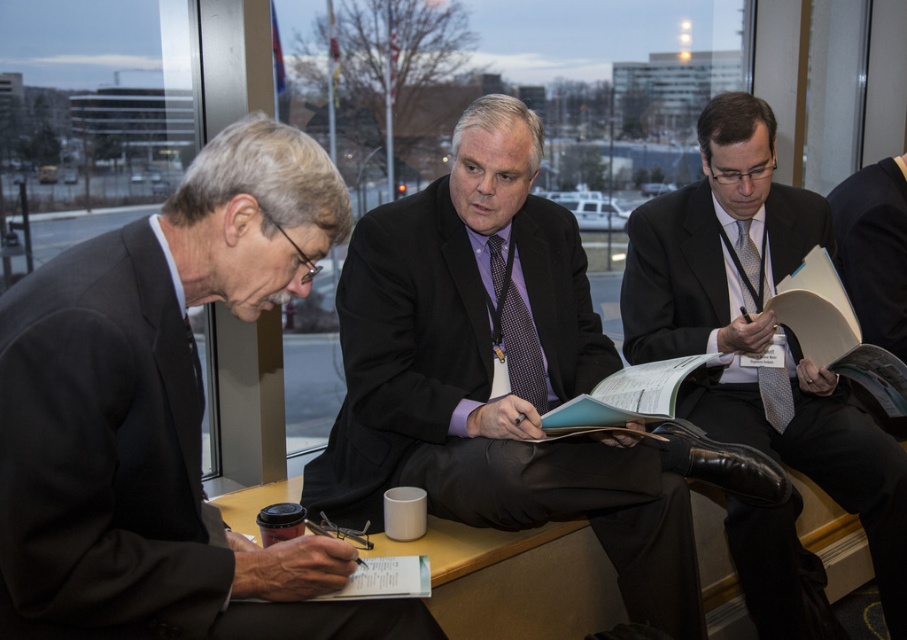
Question: Which point is closer to the camera?

Choices:
 (A) purple dotted tie at center
 (B) matte black suit at left
 (C) silver textured tie at center right

Answer: (B)

Question: Can you confirm if matte black suit at left is thinner than matte black suit at center?

Choices:
 (A) no
 (B) yes

Answer: (B)

Question: Which point is farther to the camera?

Choices:
 (A) click(172, 570)
 (B) click(600, 474)
 (C) click(512, 317)
 (D) click(857, 477)

Answer: (D)

Question: Does matte black suit at center appear on the right side of purple dotted tie at center?

Choices:
 (A) yes
 (B) no

Answer: (A)

Question: Among these objects, which one is nearest to the camera?

Choices:
 (A) purple dotted tie at center
 (B) matte black suit at left

Answer: (B)

Question: Does matte black suit at left have a lesser width compared to silver textured tie at center right?

Choices:
 (A) yes
 (B) no

Answer: (B)